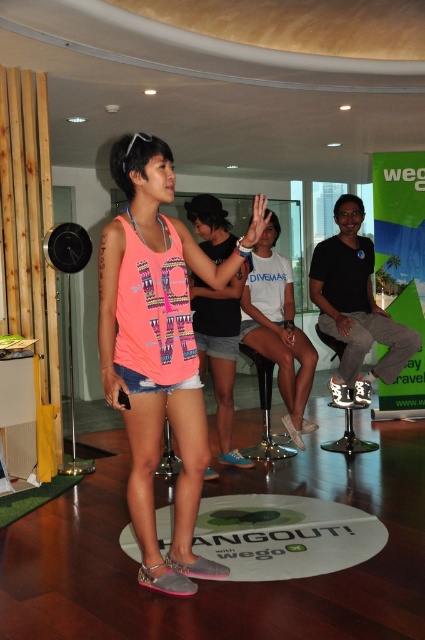
Consider the image. Does white rubber mat at center have a lesser width compared to pink fabric tank top at center?

No, white rubber mat at center is not thinner than pink fabric tank top at center.

Between white rubber mat at center and pink fabric tank top at center, which one has less height?

Standing shorter between the two is white rubber mat at center.

Locate an element on the screen. The image size is (425, 640). white rubber mat at center is located at coordinates click(x=283, y=536).

The width and height of the screenshot is (425, 640). I want to click on white rubber mat at center, so click(x=283, y=536).

Which of these two, neon pink fabric tank top at center or metallic silver stool at center, stands taller?

neon pink fabric tank top at center

Is neon pink fabric tank top at center below metallic silver stool at center?

Actually, neon pink fabric tank top at center is above metallic silver stool at center.

Does point (104, 339) come behind point (289, 452)?

No.

Where is `neon pink fabric tank top at center`? The height and width of the screenshot is (640, 425). neon pink fabric tank top at center is located at coordinates (158, 348).

Is white rubber mat at center shorter than metallic silver stool at center?

Yes.

Can you confirm if white rubber mat at center is bigger than metallic silver stool at center?

No.

Where is `white rubber mat at center`? This screenshot has width=425, height=640. white rubber mat at center is located at coordinates (283, 536).